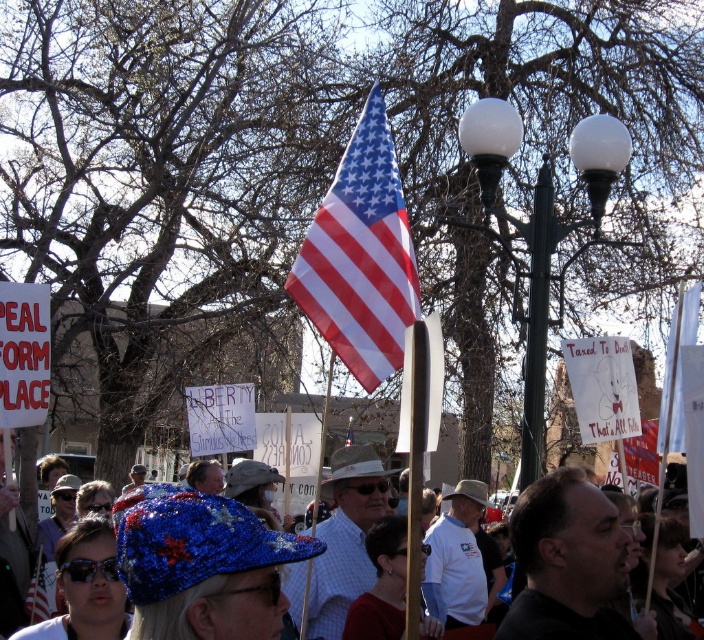
Question: Does sequined fabric hat at center have a greater width compared to green metal lamp post at upper center?

Choices:
 (A) no
 (B) yes

Answer: (B)

Question: Is green metal lamp post at upper center to the left of red fabric flag at center from the viewer's perspective?

Choices:
 (A) yes
 (B) no

Answer: (A)

Question: Which of these objects is positioned closest to the green metal lamp post at upper center?

Choices:
 (A) american flag at center
 (B) sequined fabric hat at center
 (C) red fabric flag at center

Answer: (A)

Question: Which of the following is the farthest from the observer?

Choices:
 (A) (150, 608)
 (B) (647, 428)

Answer: (B)

Question: Which object is the farthest from the sequined fabric hat at center?

Choices:
 (A) red fabric flag at center
 (B) american flag at center
 (C) green metal lamp post at upper center

Answer: (A)

Question: Is american flag at center smaller than sequined fabric hat at center?

Choices:
 (A) yes
 (B) no

Answer: (A)